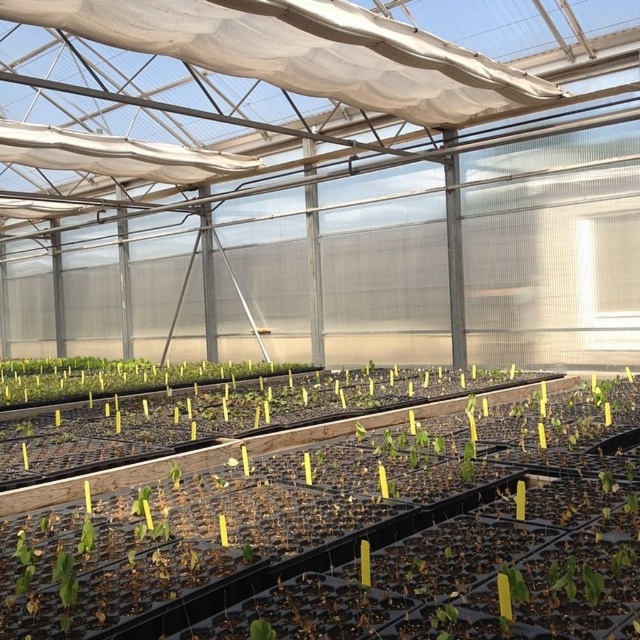
Is green matte seedling at center to the left of green matte leaf at center from the viewer's perspective?

In fact, green matte seedling at center is to the right of green matte leaf at center.

Who is more distant from viewer, (212,627) or (260,625)?

Point (212,627)

I want to click on green matte seedling at center, so click(x=353, y=531).

The image size is (640, 640). Describe the element at coordinates (116, 378) in the screenshot. I see `green leafy plants at center` at that location.

Between point (116, 392) and point (252, 637), which one is positioned behind?

Positioned behind is point (116, 392).

Is point (24, 392) positioned in front of point (266, 624)?

That is False.

Where is `green leafy plants at center`? green leafy plants at center is located at coordinates (116, 378).

Does green matte seedling at center have a larger size compared to green leafy plants at center?

Correct, green matte seedling at center is larger in size than green leafy plants at center.

How distant is green matte seedling at center from green leafy plants at center?

green matte seedling at center is 18.35 feet away from green leafy plants at center.

Does point (20, 573) lie behind point (72, 365)?

No.

The width and height of the screenshot is (640, 640). I want to click on green matte seedling at center, so click(x=353, y=531).